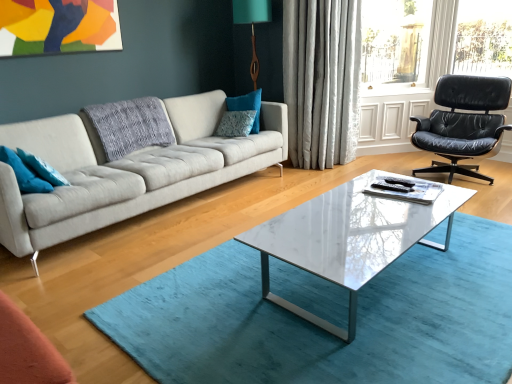
Question: Is white marble coffee table at center placed right next to teal fabric pillow at left, which appears as the first pillow when viewed from the front?

Choices:
 (A) yes
 (B) no

Answer: (B)

Question: Would you say white marble coffee table at center contains teal fabric pillow at left, positioned as the first pillow in left-to-right order?

Choices:
 (A) yes
 (B) no

Answer: (B)

Question: Considering the relative sizes of white marble coffee table at center and teal fabric pillow at left, which is counted as the fourth pillow, starting from the back, in the image provided, is white marble coffee table at center taller than teal fabric pillow at left, which is counted as the fourth pillow, starting from the back,?

Choices:
 (A) no
 (B) yes

Answer: (B)

Question: Is white marble coffee table at center to the right of teal fabric pillow at left, which is counted as the fourth pillow, starting from the back, from the viewer's perspective?

Choices:
 (A) no
 (B) yes

Answer: (B)

Question: Does white marble coffee table at center have a lesser height compared to teal fabric pillow at left, the fourth pillow when ordered from right to left?

Choices:
 (A) yes
 (B) no

Answer: (B)

Question: Is teal fabric pillow at left, which is counted as the third pillow, starting from the back, taller or shorter than light gray fabric couch at center?

Choices:
 (A) short
 (B) tall

Answer: (A)

Question: Based on their sizes in the image, would you say teal fabric pillow at left, which is counted as the third pillow, starting from the back, is bigger or smaller than light gray fabric couch at center?

Choices:
 (A) big
 (B) small

Answer: (B)

Question: From the image's perspective, is teal fabric pillow at left, which is counted as the third pillow, starting from the back, located above or below light gray fabric couch at center?

Choices:
 (A) below
 (B) above

Answer: (A)

Question: Is teal fabric pillow at left, acting as the second pillow starting from the front, in front of or behind light gray fabric couch at center in the image?

Choices:
 (A) behind
 (B) front

Answer: (A)

Question: Considering the positions of blue textured pillow at center, placed as the second pillow when sorted from right to left, and teal fabric pillow at center, the 1th pillow in the right-to-left sequence, in the image, is blue textured pillow at center, placed as the second pillow when sorted from right to left, taller or shorter than teal fabric pillow at center, the 1th pillow in the right-to-left sequence,?

Choices:
 (A) short
 (B) tall

Answer: (A)

Question: Relative to teal fabric pillow at center, the first pillow when ordered from back to front, is blue textured pillow at center, marked as the third pillow in a front-to-back arrangement, in front or behind?

Choices:
 (A) front
 (B) behind

Answer: (A)

Question: Which is correct: blue textured pillow at center, the 3th pillow when ordered from left to right, is inside teal fabric pillow at center, positioned as the fourth pillow in front-to-back order, or outside of it?

Choices:
 (A) inside
 (B) outside

Answer: (B)

Question: From the image's perspective, relative to teal fabric pillow at center, the first pillow when ordered from back to front, is blue textured pillow at center, marked as the third pillow in a front-to-back arrangement, above or below?

Choices:
 (A) below
 (B) above

Answer: (A)

Question: Do you think teal fabric pillow at center, positioned as the fourth pillow in front-to-back order, is within black leather chair at right, or outside of it?

Choices:
 (A) outside
 (B) inside

Answer: (A)

Question: Considering their positions, is teal fabric pillow at center, positioned as the fourth pillow in front-to-back order, located in front of or behind black leather chair at right?

Choices:
 (A) front
 (B) behind

Answer: (B)